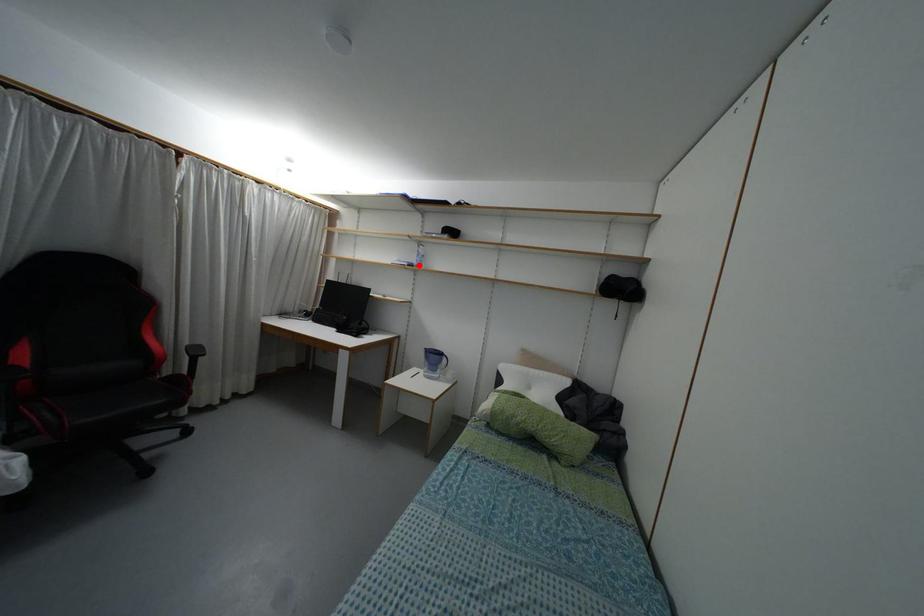
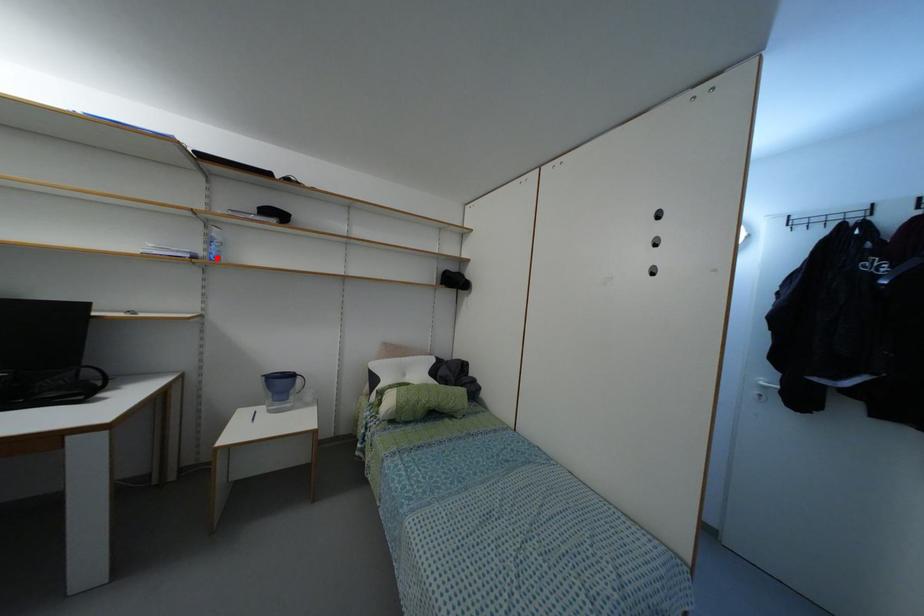
I am providing you with two images of the same scene from different viewpoints. A red point is marked on the first image and another point is marked on the second image. Are the points marked in image1 and image2 representing the same 3D position?

Yes